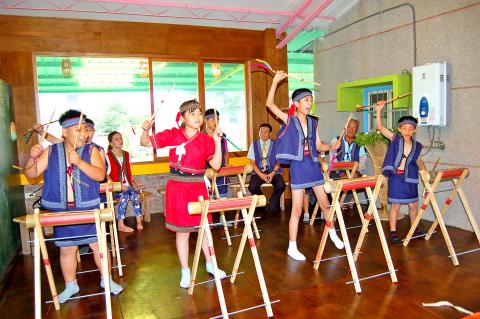
At what (x,y) coordinates should I click in order to perform the action: click on hardwood floor. Please return your answer as a coordinate pair (x, y). This screenshot has height=319, width=480. Looking at the image, I should click on (316, 302).